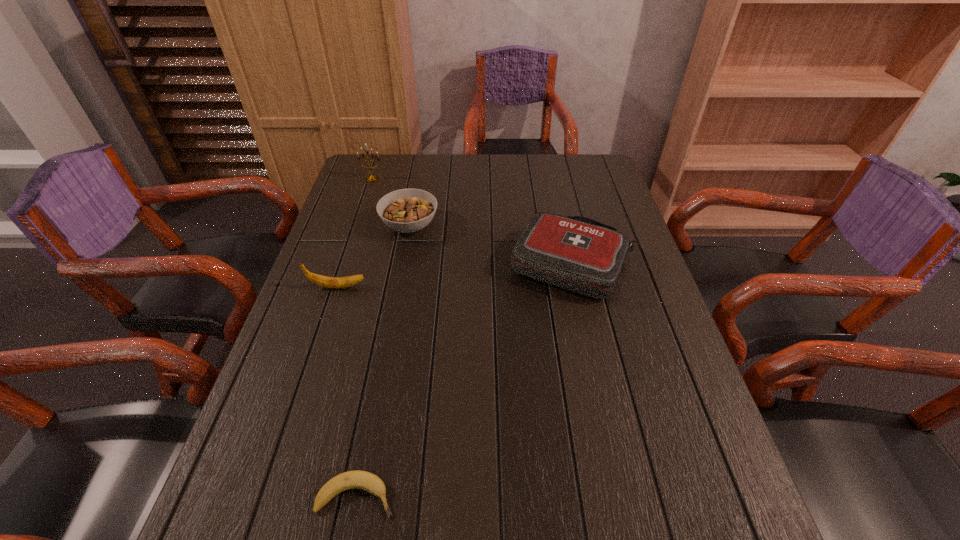
What are the coordinates of `free spot between the shorter banana and the candelabrum` in the screenshot? It's located at (364, 338).

Locate an element on the screen. empty location between the farther banana and the stew is located at coordinates (373, 256).

Where is `vacant region between the first-aid kit and the taller banana`? The image size is (960, 540). vacant region between the first-aid kit and the taller banana is located at coordinates pos(455,275).

You are a GUI agent. You are given a task and a screenshot of the screen. Output one action in this format:
    pyautogui.click(x=<x>, y=<y>)
    Task: Click on the object that is the fourth closest to the left banana
    Image resolution: width=960 pixels, height=540 pixels.
    Given the screenshot: What is the action you would take?
    pyautogui.click(x=373, y=178)

Identify which object is the third nearest to the farther banana. Please provide its 2D coordinates. Your answer should be formatted as a tuple, i.e. [(x, y)], where the tuple contains the x and y coordinates of a point satisfying the conditions above.

[(357, 479)]